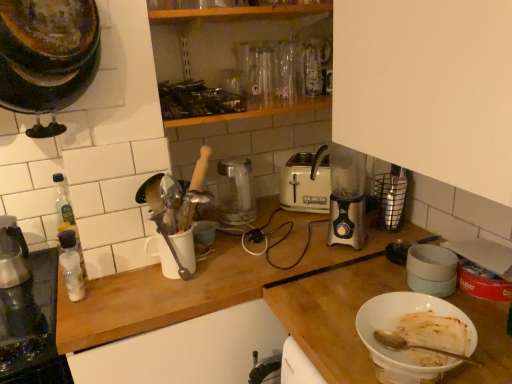
This screenshot has width=512, height=384. I want to click on free point below satin silver kettle at center, the 3th kitchen appliance viewed from the front (from a real-world perspective), so click(232, 223).